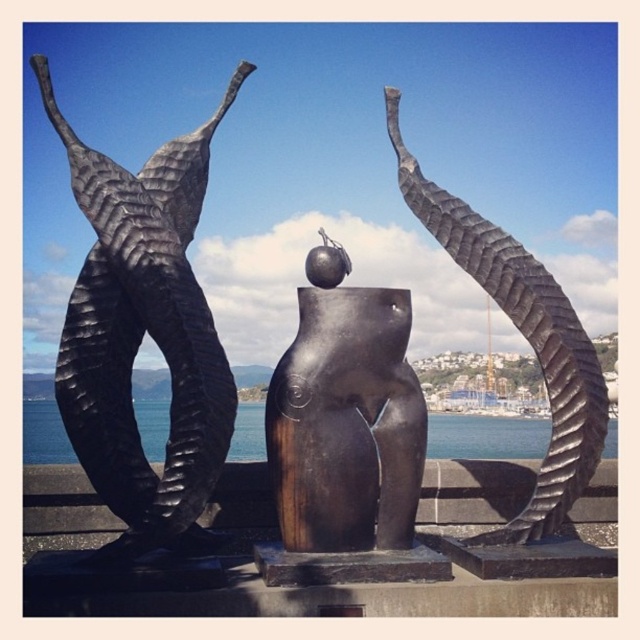
You are an art student analyzing the sculpture. You notice the matte black sculpture at left and the bronze matte torso at center. Which one is positioned higher in the image?

The matte black sculpture at left is positioned higher than the bronze matte torso at center because it is located above it.

Looking at this image, you are a photographer planning to capture the matte black sculpture at left and the blue water at center in a single shot. Based on the scene, can you determine if the sculpture is positioned higher than the water?

The matte black sculpture at left is located above the blue water at center, so yes, the sculpture is positioned higher than the water.